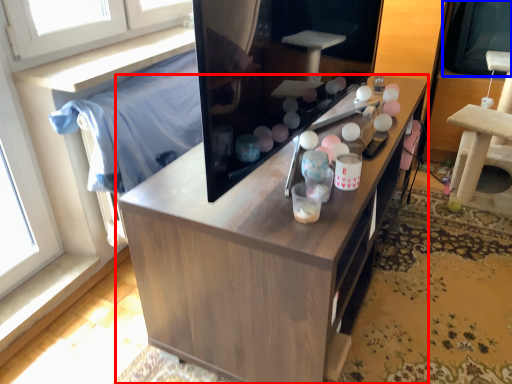
Question: Which point is further to the camera, cabinetry (highlighted by a red box) or window screen (highlighted by a blue box)?

Choices:
 (A) cabinetry
 (B) window screen

Answer: (B)